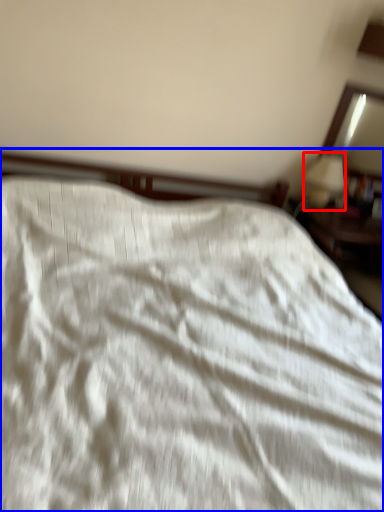
Question: Which object appears farthest to the camera in this image, table lamp (highlighted by a red box) or bed (highlighted by a blue box)?

Choices:
 (A) table lamp
 (B) bed

Answer: (A)